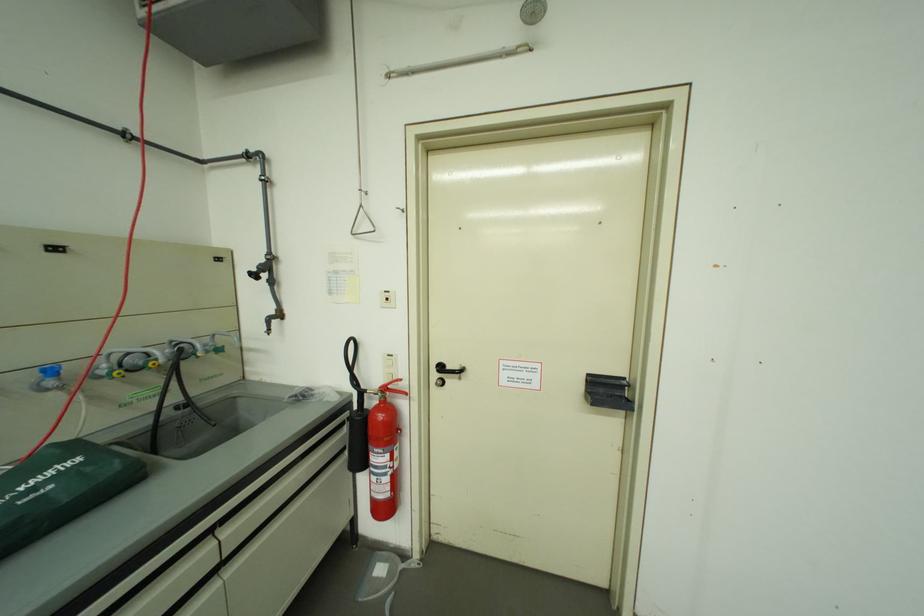
Identify the location of black door handle. (448, 370).